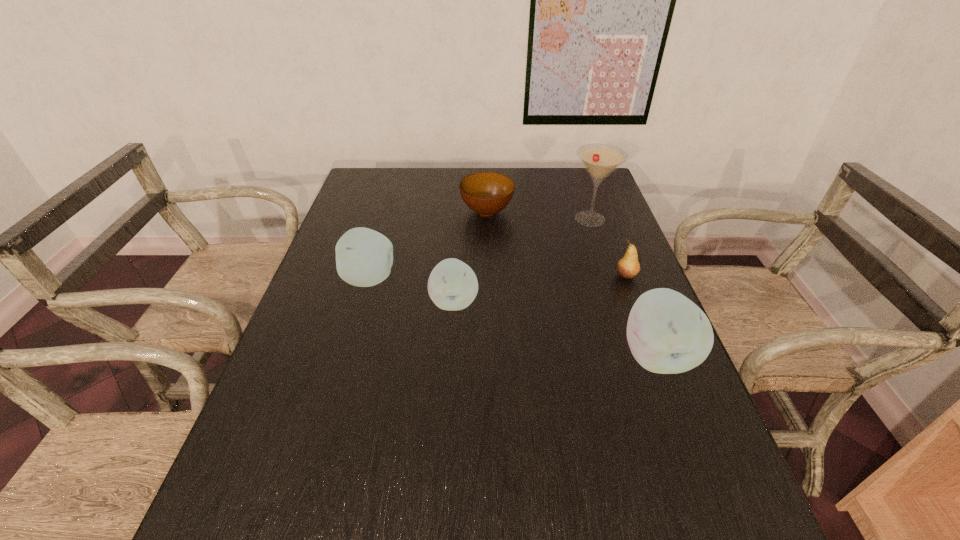
At what (x,y) coordinates should I click in order to perform the action: click on free spot between the pear and the bowl. Please return your answer as a coordinate pair (x, y). The width and height of the screenshot is (960, 540). Looking at the image, I should click on (556, 244).

Where is `empty space between the shortest object and the nearest apple`? empty space between the shortest object and the nearest apple is located at coordinates (571, 284).

I want to click on free space between the tallest object and the pear, so click(608, 247).

Locate which object ranks in proximity to the second tallest apple. Please provide its 2D coordinates. Your answer should be formatted as a tuple, i.e. [(x, y)], where the tuple contains the x and y coordinates of a point satisfying the conditions above.

[(452, 285)]

Locate an element on the screen. The height and width of the screenshot is (540, 960). object that can be found as the fifth closest to the martini is located at coordinates (364, 257).

Locate an element on the screen. apple that is the closest one to the leftmost apple is located at coordinates 452,285.

The width and height of the screenshot is (960, 540). Find the location of `apple that stands as the third closest to the pear`. apple that stands as the third closest to the pear is located at coordinates (x=364, y=257).

Where is `vacant point that satisfies the following two spatial constraints: 1. on the front side of the second apple from right to left; 2. on the left side of the leftmost apple`? The width and height of the screenshot is (960, 540). vacant point that satisfies the following two spatial constraints: 1. on the front side of the second apple from right to left; 2. on the left side of the leftmost apple is located at coordinates (364, 302).

The image size is (960, 540). In order to click on free location that satisfies the following two spatial constraints: 1. on the front side of the tallest object; 2. on the left side of the nearest object in this screenshot , I will do `click(636, 355)`.

Find the location of a particular element. vacant space that satisfies the following two spatial constraints: 1. on the front side of the nearest apple; 2. on the left side of the leftmost apple is located at coordinates (348, 355).